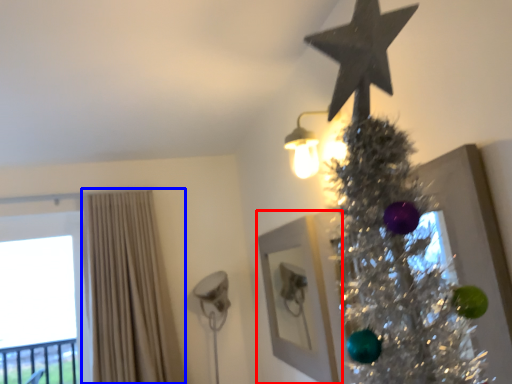
Question: Which of the following is the farthest to the observer, picture frame (highlighted by a red box) or curtain (highlighted by a blue box)?

Choices:
 (A) picture frame
 (B) curtain

Answer: (B)